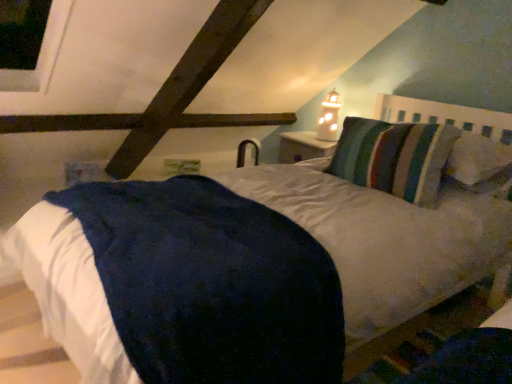
Question: Considering the relative sizes of white frosted glass at upper center and dark blue plush mattress at center in the image provided, is white frosted glass at upper center bigger than dark blue plush mattress at center?

Choices:
 (A) no
 (B) yes

Answer: (A)

Question: Does white frosted glass at upper center appear on the left side of dark blue plush mattress at center?

Choices:
 (A) no
 (B) yes

Answer: (A)

Question: Can you confirm if white frosted glass at upper center is shorter than dark blue plush mattress at center?

Choices:
 (A) yes
 (B) no

Answer: (B)

Question: Is white frosted glass at upper center further to camera compared to dark blue plush mattress at center?

Choices:
 (A) no
 (B) yes

Answer: (B)

Question: Would you say dark blue plush mattress at center is part of white frosted glass at upper center's contents?

Choices:
 (A) no
 (B) yes

Answer: (A)

Question: Is white frosted glass at upper center not within dark blue plush mattress at center?

Choices:
 (A) no
 (B) yes

Answer: (B)

Question: From the image's perspective, is dark blue plush mattress at center below striped fabric pillow at upper right?

Choices:
 (A) yes
 (B) no

Answer: (A)

Question: Does dark blue plush mattress at center have a greater width compared to striped fabric pillow at upper right?

Choices:
 (A) yes
 (B) no

Answer: (A)

Question: Is dark blue plush mattress at center taller than striped fabric pillow at upper right?

Choices:
 (A) yes
 (B) no

Answer: (B)

Question: Is dark blue plush mattress at center with striped fabric pillow at upper right?

Choices:
 (A) no
 (B) yes

Answer: (A)

Question: Considering the relative sizes of dark blue plush mattress at center and striped fabric pillow at upper right in the image provided, is dark blue plush mattress at center shorter than striped fabric pillow at upper right?

Choices:
 (A) no
 (B) yes

Answer: (B)

Question: Considering the relative positions of dark blue plush mattress at center and striped fabric pillow at upper right in the image provided, is dark blue plush mattress at center in front of striped fabric pillow at upper right?

Choices:
 (A) yes
 (B) no

Answer: (A)

Question: From the image's perspective, is striped fabric pillow at upper right located beneath white frosted glass at upper center?

Choices:
 (A) yes
 (B) no

Answer: (A)